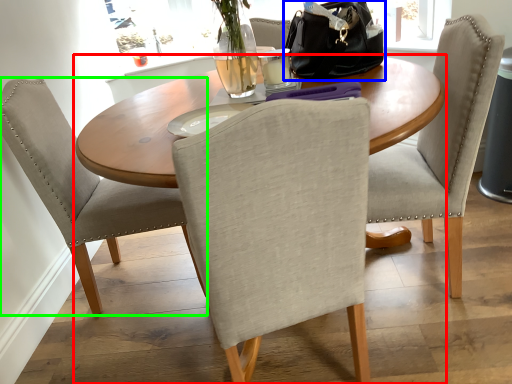
Question: Estimate the real-world distances between objects in this image. Which object is farther from kitchen & dining room table (highlighted by a red box), handbag (highlighted by a blue box) or chair (highlighted by a green box)?

Choices:
 (A) handbag
 (B) chair

Answer: (A)